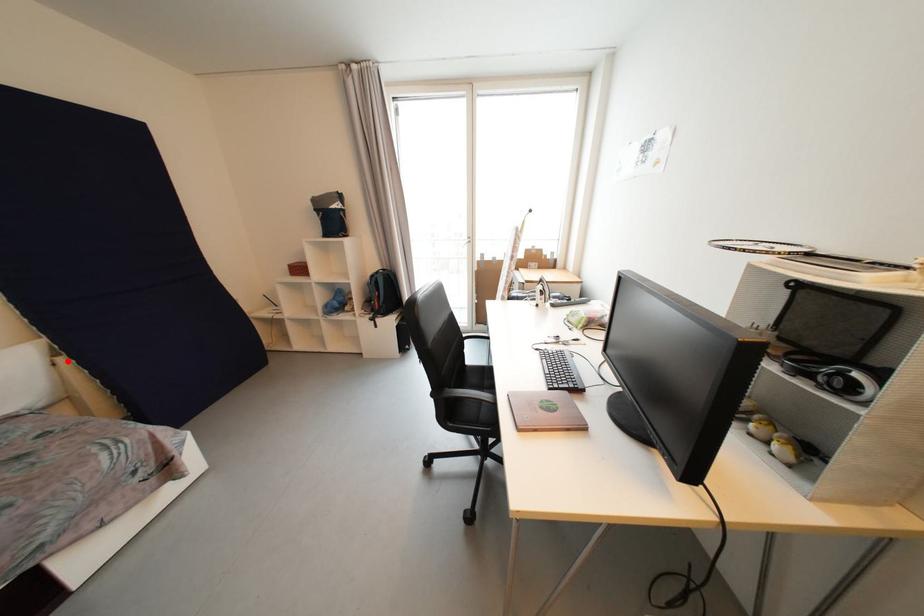
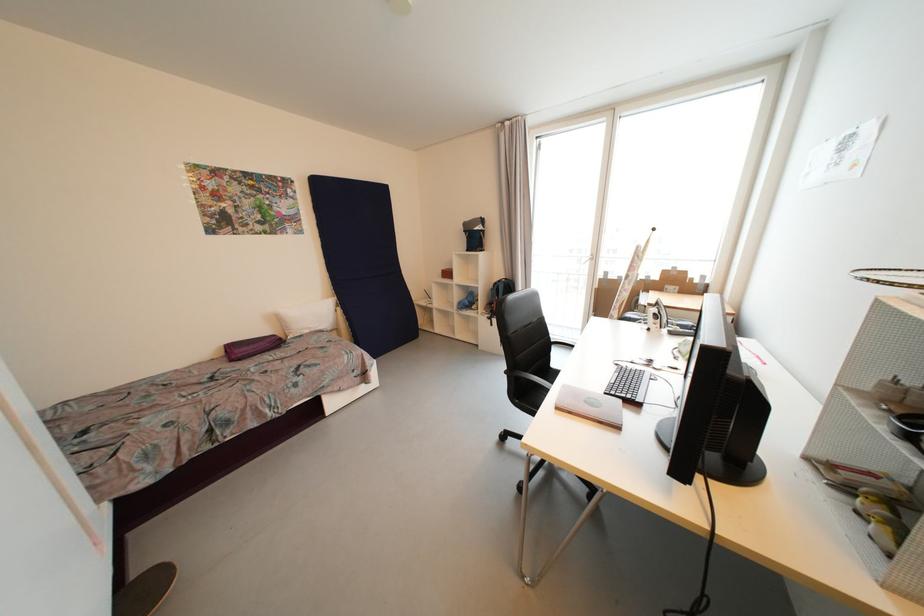
Question: A red point is marked in image1. In image2, is the corresponding 3D point closer to the camera or farther? Reply with the corresponding letter.

Choices:
 (A) The corresponding 3D point is closer.
 (B) The corresponding 3D point is farther.

Answer: (B)